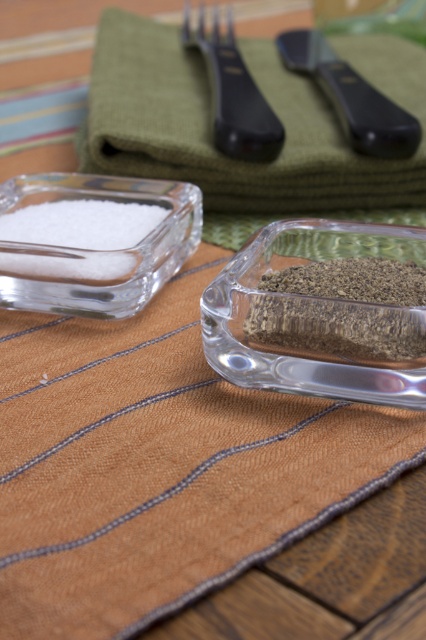
You are setting up a table and need to place a decorative plate between the white crystalline salt at left and the black plastic fork at upper center. Based on their positions, where should the plate be placed to ensure it is centered between them?

The plate should be placed between the white crystalline salt at left and the black plastic fork at upper center. Since the white crystalline salt at left might be wider than the black plastic fork at upper center, the center point would be closer to the fork to account for the salt container being wider.

You are a chef holding a spoon that is 12 inches long. You want to sprinkle salt from the container at point [416,145] onto your dish. Can you reach the container without moving your arm?

The containers are 13.04 inches apart, so the spoon is 12 inches long. Therefore, the chef cannot reach the container at point [416,145] without moving their arm because the distance between them is greater than the spoon length.

You are looking at the table setting and notice two points marked on the image. The first point is at coordinate (359, 99) and the second is at (229, 86). Which of these points is closer to you?

Point (359, 99) is closer to the viewer than point (229, 86).